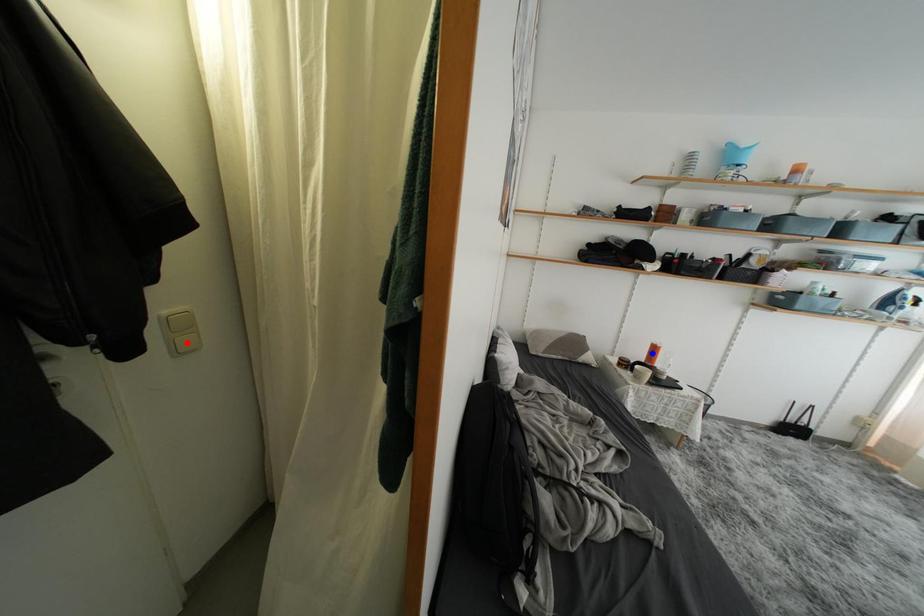
Question: In the image, two points are highlighted. Which point is nearer to the camera? Reply with the corresponding letter.

Choices:
 (A) blue point
 (B) red point

Answer: (B)